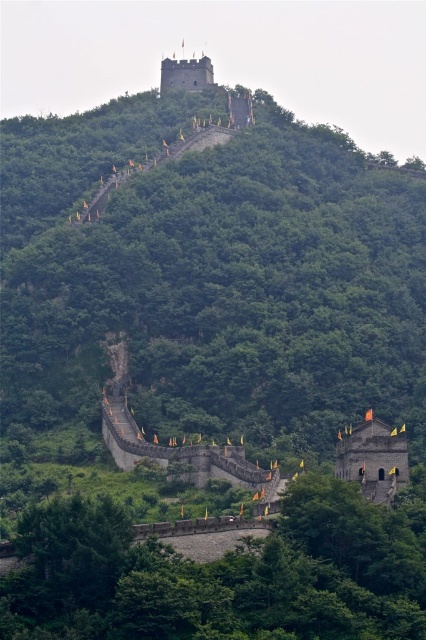
Identify the location of stone wall at center. The width and height of the screenshot is (426, 640). (181, 452).

In the scene shown: Does stone wall at center appear on the right side of smooth gray stone tower at upper center?

Indeed, stone wall at center is positioned on the right side of smooth gray stone tower at upper center.

Locate an element on the screen. stone wall at center is located at coordinates (181, 452).

Is point (394, 467) closer to camera compared to point (198, 68)?

Yes, point (394, 467) is closer to viewer.

What do you see at coordinates (373, 458) in the screenshot? I see `rustic stone tower at center` at bounding box center [373, 458].

The height and width of the screenshot is (640, 426). Identify the location of rustic stone tower at center. (373, 458).

Locate an element on the screen. The height and width of the screenshot is (640, 426). rustic stone tower at center is located at coordinates (373, 458).

From the picture: Does stone wall at center have a lesser height compared to rustic stone tower at center?

No, stone wall at center is not shorter than rustic stone tower at center.

The height and width of the screenshot is (640, 426). Describe the element at coordinates (181, 452) in the screenshot. I see `stone wall at center` at that location.

Where is `stone wall at center`? Image resolution: width=426 pixels, height=640 pixels. stone wall at center is located at coordinates (181, 452).